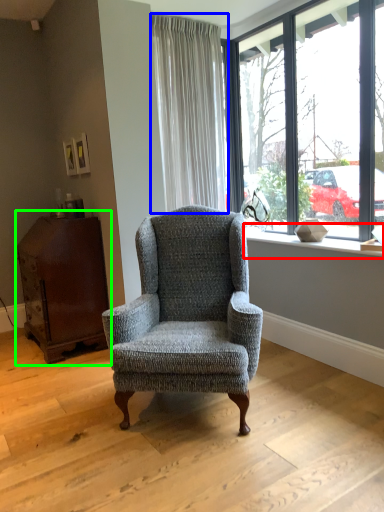
Question: Which is farther away from window sill (highlighted by a red box)? curtain (highlighted by a blue box) or dresser (highlighted by a green box)?

Choices:
 (A) curtain
 (B) dresser

Answer: (B)